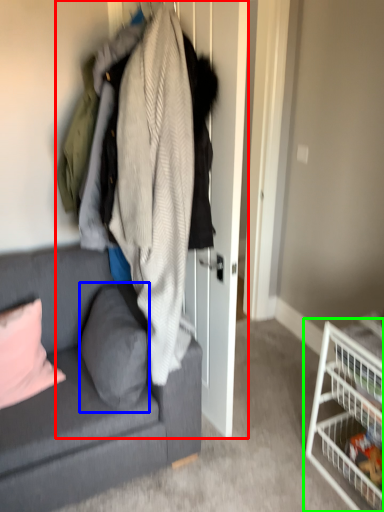
Question: Which is farther away from closet (highlighted by a red box)? pillow (highlighted by a blue box) or shelf (highlighted by a green box)?

Choices:
 (A) pillow
 (B) shelf

Answer: (B)